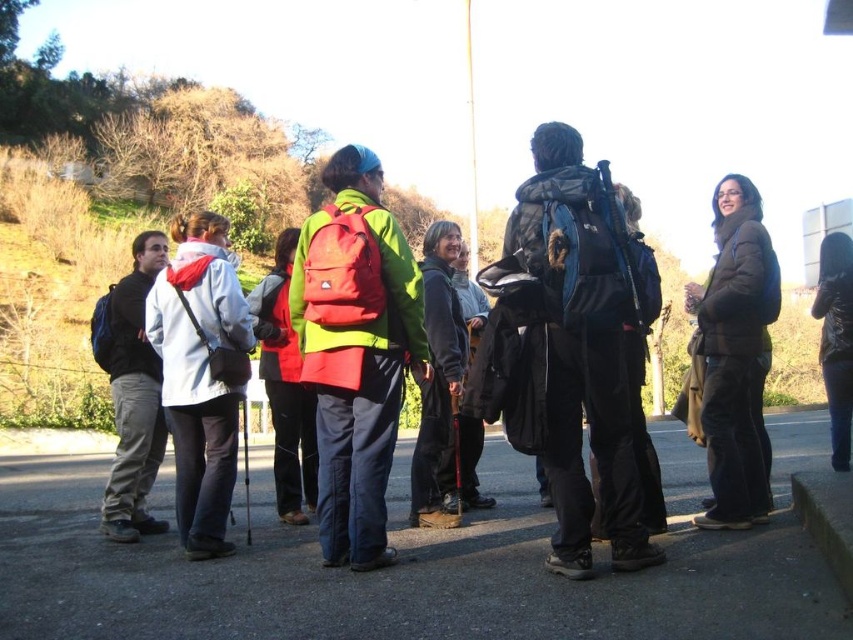
You are a photographer trying to capture a candid shot of the group. You notice the white matte jacket at left and the matte black backpack at left are partially blocking your view. Which object should you move closer to ensure the jacket remains visible while the backpack is slightly out of frame?

You should move closer to the white matte jacket at left since it is nearer to you than the matte black backpack at left. By positioning yourself closer to the jacket, it will stay in the foreground while the backpack, being further back, may naturally fall out of the frame or become less prominent in the shot.

You are a photographer trying to capture the red matte backpack at center and the dark gray fleece jacket at center in the same frame. Based on their positions, which object should you focus on first to ensure both are in focus?

The red matte backpack at center is above the dark gray fleece jacket at center. To ensure both are in focus, you should focus on the dark gray fleece jacket at center first since it is closer to the camera, allowing the backpack above it to remain in the same focal plane.

You are part of a hiking group and need to locate your friend wearing the brown matte jacket at center and the dark gray fleece jacket at center. Since you are standing behind the group, which jacket will you see first when looking towards the center?

The brown matte jacket at center is closer to the viewer than the dark gray fleece jacket at center, so you will see the brown matte jacket at center first when looking towards the center.